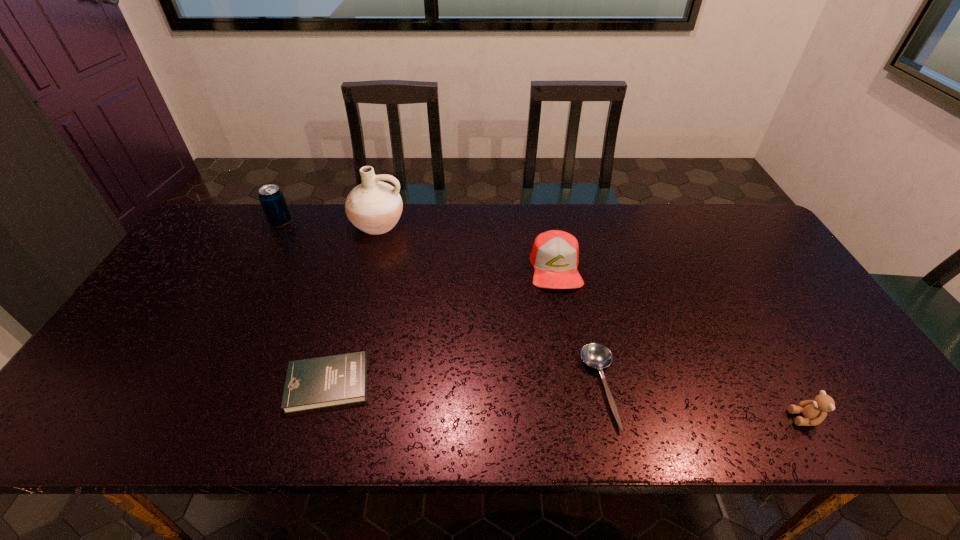
The width and height of the screenshot is (960, 540). What are the coordinates of `empty space between the fourth tallest object and the fifth shortest object` in the screenshot? It's located at (542, 320).

Image resolution: width=960 pixels, height=540 pixels. I want to click on empty space that is in between the baseball cap and the teddy bear, so click(680, 343).

The width and height of the screenshot is (960, 540). I want to click on free spot between the book and the rightmost object, so click(566, 401).

Find the location of `vacant space that is in between the leftmost object and the ladle`. vacant space that is in between the leftmost object and the ladle is located at coordinates (441, 305).

Locate an element on the screen. The width and height of the screenshot is (960, 540). vacant region between the soda can and the shortest object is located at coordinates (441, 305).

Locate an element on the screen. empty location between the book and the tallest object is located at coordinates point(352,304).

Find the location of a particular element. free space between the shortest object and the third farthest object is located at coordinates (578, 328).

This screenshot has height=540, width=960. I want to click on object identified as the fifth closest to the shortest object, so [271, 197].

Point out which object is positioned as the fifth nearest to the second tallest object. Please provide its 2D coordinates. Your answer should be formatted as a tuple, i.e. [(x, y)], where the tuple contains the x and y coordinates of a point satisfying the conditions above.

[(814, 411)]

At what (x,y) coordinates should I click in order to perform the action: click on free space that satisfies the following two spatial constraints: 1. to pour from the handle of the ladle; 2. on the left side of the pottery. Please return your answer as a coordinate pair (x, y). This screenshot has height=540, width=960. Looking at the image, I should click on (332, 388).